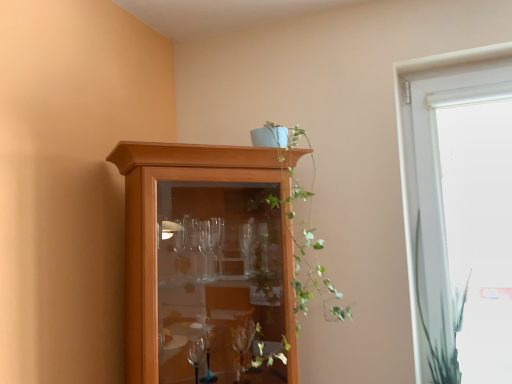
The height and width of the screenshot is (384, 512). What do you see at coordinates (441, 328) in the screenshot? I see `green leafy plant at right` at bounding box center [441, 328].

You are a GUI agent. You are given a task and a screenshot of the screen. Output one action in this format:
    pyautogui.click(x=<x>, y=<y>)
    Task: Click on the wooden cabinet at upper center
    This screenshot has height=384, width=512.
    Given the screenshot: What is the action you would take?
    pyautogui.click(x=207, y=261)

What's the angular difference between white glass window at right and green leafy plant at right's facing directions?

There is a 0.000216-degree angle between the facing directions of white glass window at right and green leafy plant at right.

Is white glass window at right not near green leafy plant at right?

Actually, white glass window at right and green leafy plant at right are a little close together.

From a real-world perspective, which object rests below the other?

green leafy plant at right.

From the picture: Which is closer, (412,175) or (414,276)?

Point (412,175).

Looking at this image, in the image, is green leafy plant at upper center positioned in front of or behind wooden cabinet at upper center?

Visually, green leafy plant at upper center is located behind wooden cabinet at upper center.

Can you tell me how much green leafy plant at upper center and wooden cabinet at upper center differ in facing direction?

green leafy plant at upper center and wooden cabinet at upper center are facing 0.000527 degrees away from each other.

Considering the sizes of green leafy plant at upper center and wooden cabinet at upper center in the image, is green leafy plant at upper center taller or shorter than wooden cabinet at upper center?

Considering their sizes, green leafy plant at upper center has less height than wooden cabinet at upper center.

Which object is positioned more to the right, green leafy plant at upper center or wooden cabinet at upper center?

green leafy plant at upper center is more to the right.

Between green leafy plant at right and wooden cabinet at upper center, which one has larger size?

wooden cabinet at upper center is bigger.

Is green leafy plant at right taller or shorter than wooden cabinet at upper center?

Considering their sizes, green leafy plant at right has less height than wooden cabinet at upper center.

Looking at this image, in the image, is green leafy plant at right positioned in front of or behind wooden cabinet at upper center?

green leafy plant at right is behind wooden cabinet at upper center.

Does point (436, 352) appear closer or farther from the camera than point (174, 346)?

Clearly, point (436, 352) is more distant from the camera than point (174, 346).

Is green leafy plant at upper center in front of or behind green leafy plant at right in the image?

Clearly, green leafy plant at upper center is in front of green leafy plant at right.

Does green leafy plant at upper center have a smaller size compared to green leafy plant at right?

Actually, green leafy plant at upper center might be larger than green leafy plant at right.

From a real-world perspective, which object stands above the other?

green leafy plant at upper center is physically above.

Between green leafy plant at upper center and green leafy plant at right, which one appears on the right side from the viewer's perspective?

green leafy plant at right is more to the right.

Considering the relative sizes of wooden cabinet at upper center and green leafy plant at upper center in the image provided, is wooden cabinet at upper center smaller than green leafy plant at upper center?

Actually, wooden cabinet at upper center might be larger than green leafy plant at upper center.

Is wooden cabinet at upper center to the right of green leafy plant at upper center from the viewer's perspective?

No.

From the image's perspective, which is above, wooden cabinet at upper center or green leafy plant at upper center?

green leafy plant at upper center.

Is there a large distance between wooden cabinet at upper center and green leafy plant at upper center?

No, wooden cabinet at upper center is in close proximity to green leafy plant at upper center.

From a real-world perspective, is green leafy plant at right physically located above or below green leafy plant at upper center?

In terms of real-world spatial position, green leafy plant at right is below green leafy plant at upper center.

Which object is more forward, green leafy plant at right or green leafy plant at upper center?

green leafy plant at upper center is more forward.

Based on the photo, considering the sizes of objects green leafy plant at right and green leafy plant at upper center in the image provided, who is smaller, green leafy plant at right or green leafy plant at upper center?

With smaller size is green leafy plant at right.

Considering the positions of objects green leafy plant at upper center and white glass window at right in the image provided, who is more to the left, green leafy plant at upper center or white glass window at right?

green leafy plant at upper center is more to the left.

Is green leafy plant at upper center oriented towards white glass window at right?

No.

Does green leafy plant at upper center contain white glass window at right?

Actually, white glass window at right is outside green leafy plant at upper center.

Identify the location of window below the green leafy plant at upper center (from the image's perspective). (436, 168).

This screenshot has width=512, height=384. I want to click on window to the right of green leafy plant at right, so click(436, 168).

At what (x,y) coordinates should I click in order to perform the action: click on cupboard that is in front of the green leafy plant at upper center. Please return your answer as a coordinate pair (x, y). The image size is (512, 384). Looking at the image, I should click on (207, 261).

Based on their spatial positions, is green leafy plant at right or green leafy plant at upper center further from white glass window at right?

green leafy plant at upper center.

Considering their positions, is wooden cabinet at upper center positioned closer to white glass window at right than green leafy plant at upper center?

The object closer to white glass window at right is green leafy plant at upper center.

Looking at the image, which one is located closer to white glass window at right, green leafy plant at upper center or wooden cabinet at upper center?

green leafy plant at upper center lies closer to white glass window at right than the other object.

Consider the image. When comparing their distances from wooden cabinet at upper center, does white glass window at right or green leafy plant at right seem further?

green leafy plant at right.

From the image, which object appears to be nearer to white glass window at right, wooden cabinet at upper center or green leafy plant at right?

green leafy plant at right.

Considering their positions, is green leafy plant at right positioned closer to green leafy plant at upper center than wooden cabinet at upper center?

Among the two, wooden cabinet at upper center is located nearer to green leafy plant at upper center.

Considering their positions, is white glass window at right positioned closer to wooden cabinet at upper center than green leafy plant at upper center?

green leafy plant at upper center.

Considering their positions, is green leafy plant at upper center positioned further to green leafy plant at right than wooden cabinet at upper center?

wooden cabinet at upper center is positioned further to the anchor green leafy plant at right.

Find the location of a particular element. The height and width of the screenshot is (384, 512). vegetation located between wooden cabinet at upper center and white glass window at right in the left-right direction is located at coordinates (441, 328).

Where is `houseplant between wooden cabinet at upper center and green leafy plant at right`? This screenshot has width=512, height=384. houseplant between wooden cabinet at upper center and green leafy plant at right is located at coordinates (300, 224).

The image size is (512, 384). I want to click on houseplant located between wooden cabinet at upper center and white glass window at right in the left-right direction, so click(x=300, y=224).

Locate an element on the screen. vegetation between green leafy plant at upper center and white glass window at right is located at coordinates (441, 328).